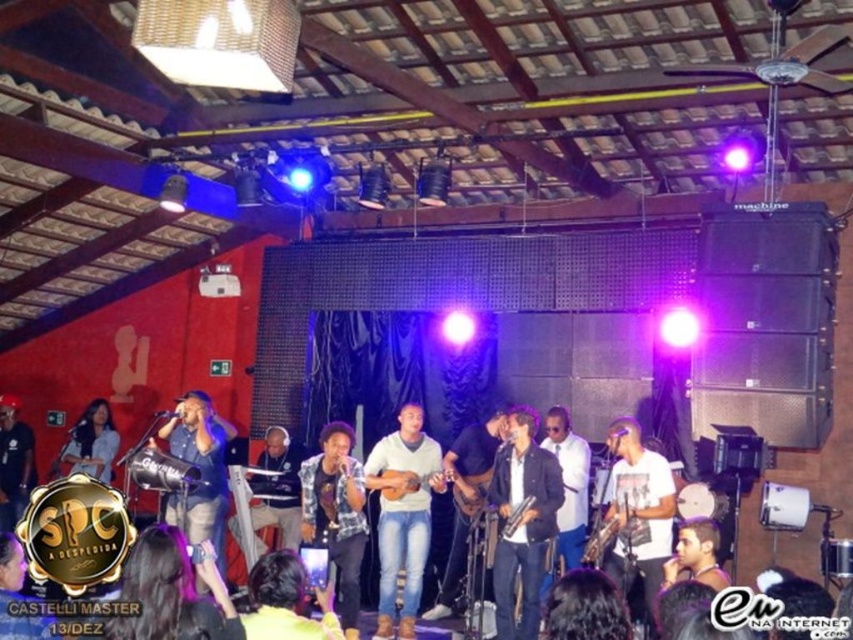
Looking at this image, you are a photographer at the event and want to capture a closeup of the white matte sweater at center. Based on its position, where should you aim your camera?

The white matte sweater at center is located at point 0.808 on the x axis and 0.472 on the y axis, so you should aim your camera towards those coordinates to capture the closeup.

In the scene shown: You are a photographer at the music event and want to capture a closeup of the plaid shirt at center and the matte black guitar at left. Since your camera has a limited focus range, which object should you prioritize to ensure it appears sharp in the photo?

The plaid shirt at center should be prioritized because it is bigger than the matte black guitar at left, making it easier to focus on.